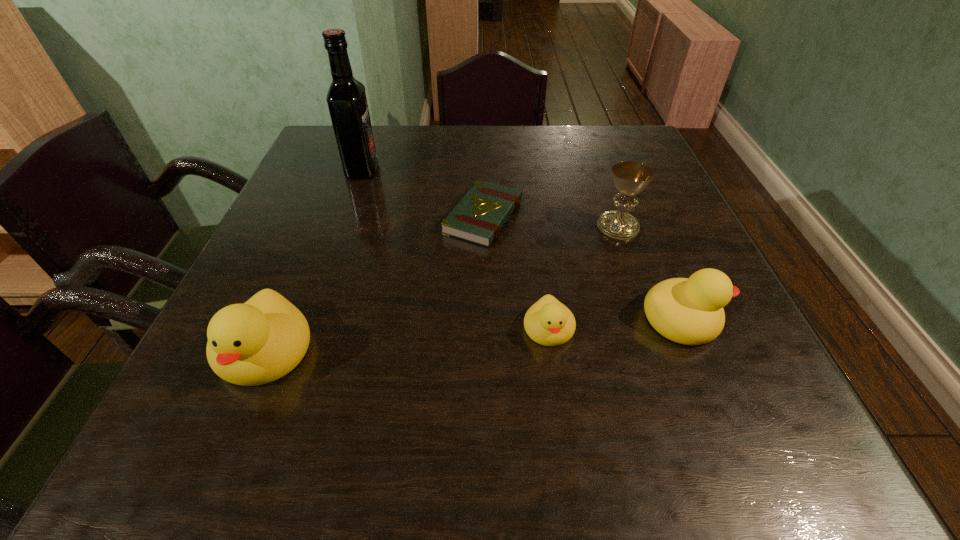
This screenshot has height=540, width=960. I want to click on object that is positioned at the near left corner, so click(x=257, y=342).

At what (x,y) coordinates should I click in order to perform the action: click on vacant space at the far edge of the desktop. Please return your answer as a coordinate pair (x, y). Looking at the image, I should click on (520, 166).

Where is `free space at the near edge of the desktop`? The image size is (960, 540). free space at the near edge of the desktop is located at coordinates (501, 400).

You are a GUI agent. You are given a task and a screenshot of the screen. Output one action in this format:
    pyautogui.click(x=<x>, y=<y>)
    Task: Click on the vacant region at the left edge of the desktop
    Image resolution: width=960 pixels, height=540 pixels.
    Given the screenshot: What is the action you would take?
    pyautogui.click(x=251, y=261)

Find the location of a particular element. vacant space at the right edge is located at coordinates (667, 231).

Identify the location of vacant space at the far right corner of the desktop. The image size is (960, 540). [600, 149].

The height and width of the screenshot is (540, 960). What are the coordinates of `blank region between the third shortest object and the shortest object` in the screenshot? It's located at (583, 267).

Image resolution: width=960 pixels, height=540 pixels. I want to click on empty space between the second duckling from right to left and the leftmost duckling, so click(x=407, y=340).

Find the location of a particular element. The image size is (960, 540). free space between the chalice and the shortest duckling is located at coordinates (584, 278).

Where is `unoccupied position between the farthest object and the second shortest object`? unoccupied position between the farthest object and the second shortest object is located at coordinates (455, 249).